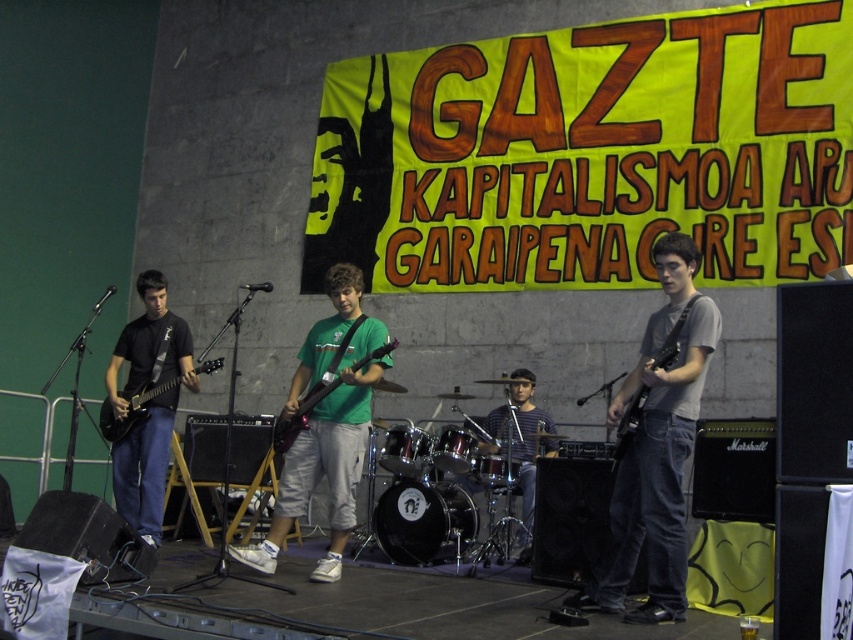
You are a photographer at the back of the venue and want to capture a clear photo of the green matte shirt at center and the matte black electric guitar at center. Based on their positions, which object is closer to the camera?

The green matte shirt at center is positioned under the matte black electric guitar at center, so the guitar is closer to the camera than the shirt.

You are a photographer trying to capture the band members on stage. You notice two points marked on your camera screen. One is at point (334, 556) and the other at point (514, 458). Which point is closer to the camera and thus likely to be in focus if you focus on that point?

The point at (334, 556) is closer to the camera than the point at (514, 458), so focusing on it would likely keep that area in focus.